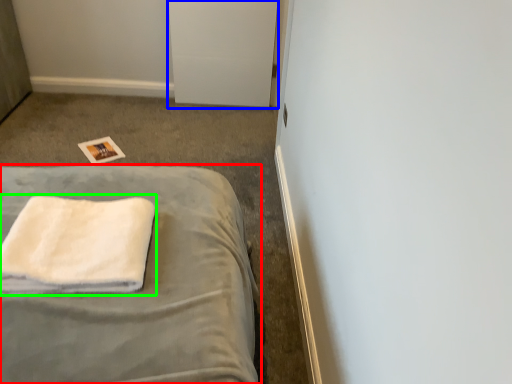
Question: Which object is the closest to the bed (highlighted by a red box)? Choose among these: file cabinet (highlighted by a blue box) or towel (highlighted by a green box).

Choices:
 (A) file cabinet
 (B) towel

Answer: (B)